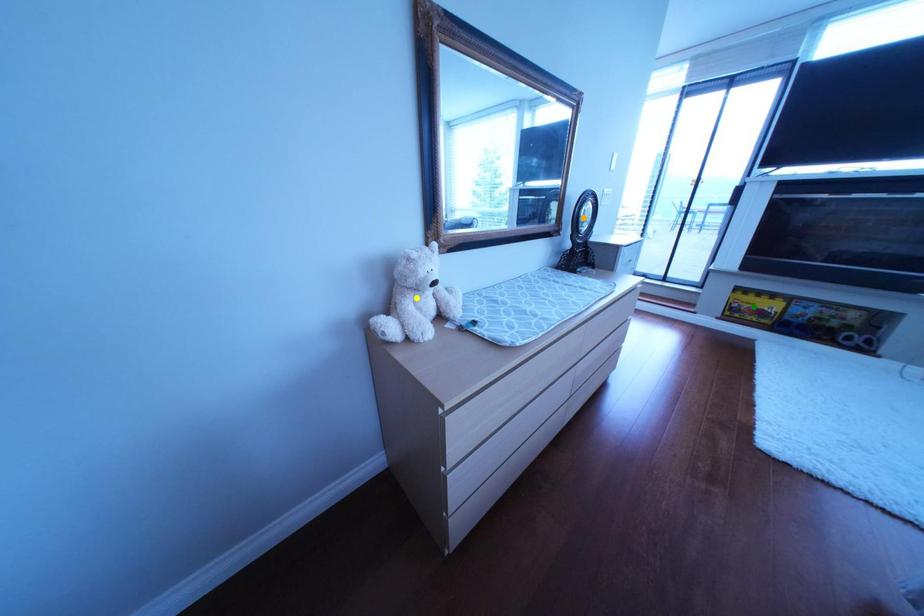
Order these from nearest to farthest:
1. orange point
2. green point
3. yellow point

yellow point → orange point → green point